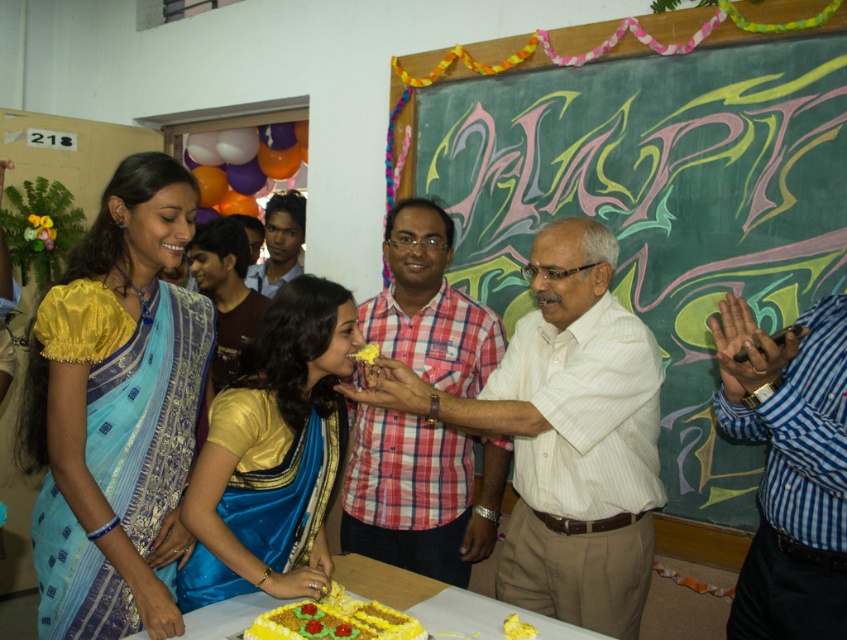
Question: Is blue checkered shirt at center bigger than matte brown hair at center?

Choices:
 (A) yes
 (B) no

Answer: (A)

Question: Is silk saree at left positioned in front of yellow satin saree at center?

Choices:
 (A) yes
 (B) no

Answer: (A)

Question: Can you confirm if white striped shirt at center is positioned to the right of yellow satin saree at center?

Choices:
 (A) no
 (B) yes

Answer: (B)

Question: Which point is closer to the camera taking this photo?

Choices:
 (A) (285, 532)
 (B) (429, 284)
 (C) (203, 289)
 (D) (284, 220)

Answer: (A)

Question: Which object appears farthest from the camera in this image?

Choices:
 (A) yellow satin saree at center
 (B) green chalkboard at upper center
 (C) yellow textured cake at center
 (D) white striped shirt at center

Answer: (A)

Question: Estimate the real-world distances between objects in this image. Which object is farther from the yellow textured cake at center?

Choices:
 (A) yellow satin saree at center
 (B) silk saree at left
 (C) checkered fabric shirt at center
 (D) blue checkered shirt at center

Answer: (A)